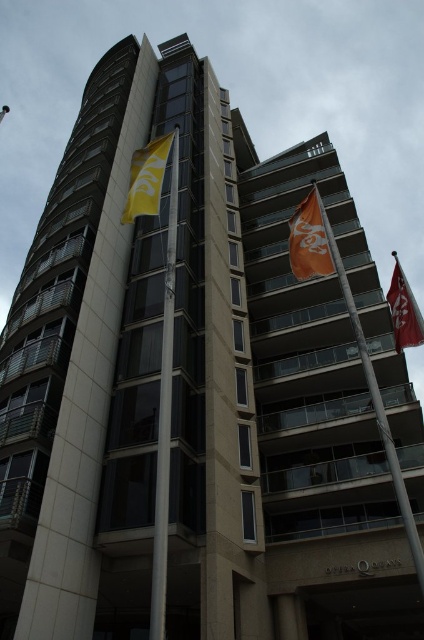
You are standing at the entrance of the building and want to locate the white metallic pole at center. According to the coordinates provided, where should you look relative to your position?

The white metallic pole at center is located at coordinates point (164, 400), which means it is positioned to the right and slightly above your current line of sight.

You are standing at the entrance of the modern building and want to locate the central flagpole. According to the image, where exactly is the white metallic pole at center positioned?

The white metallic pole at center is positioned at the 2D coordinates point (164,400).

You are standing in front of the building and want to hang a new flag between the white metallic pole at center and the yellow fabric flag at upper left. Based on their positions, which object should the new flag be placed to the right of?

The new flag should be placed to the right of the yellow fabric flag at upper left because the white metallic pole at center is positioned on the right side of yellow fabric flag at upper left.